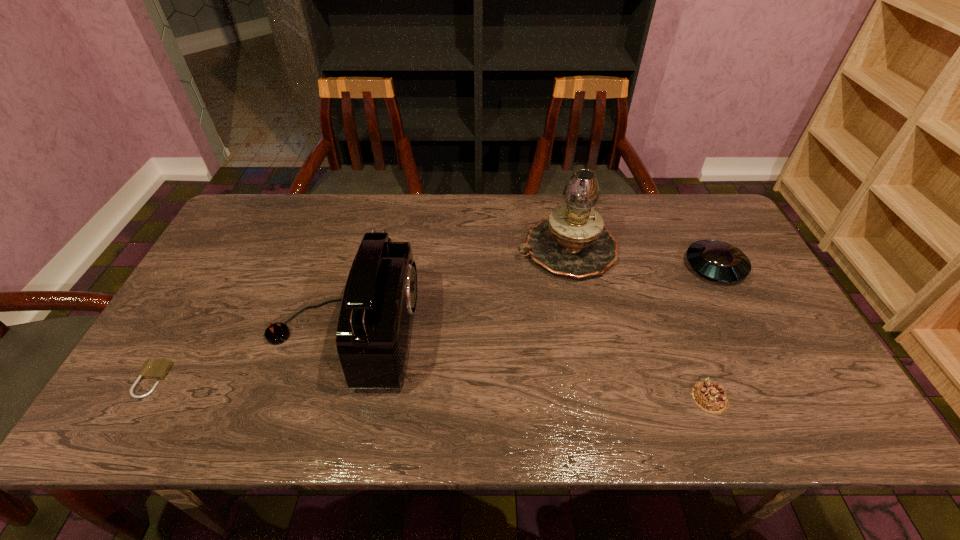
Where is `empty space between the third object from left to right and the rightmost object`? empty space between the third object from left to right and the rightmost object is located at coordinates (641, 258).

This screenshot has height=540, width=960. I want to click on the fourth closest object to the shortest object, so click(717, 260).

Identify which object is located as the second nearest to the saucer. Please provide its 2D coordinates. Your answer should be formatted as a tuple, i.e. [(x, y)], where the tuple contains the x and y coordinates of a point satisfying the conditions above.

[(710, 397)]

The width and height of the screenshot is (960, 540). I want to click on free space in the image that satisfies the following two spatial constraints: 1. on the back side of the chocolate cake; 2. on the front-facing side of the radio receiver, so click(684, 333).

In order to click on vacant space that satisfies the following two spatial constraints: 1. on the front-facing side of the fourth tallest object; 2. on the left side of the fourth object from right to left in this screenshot , I will do `click(325, 398)`.